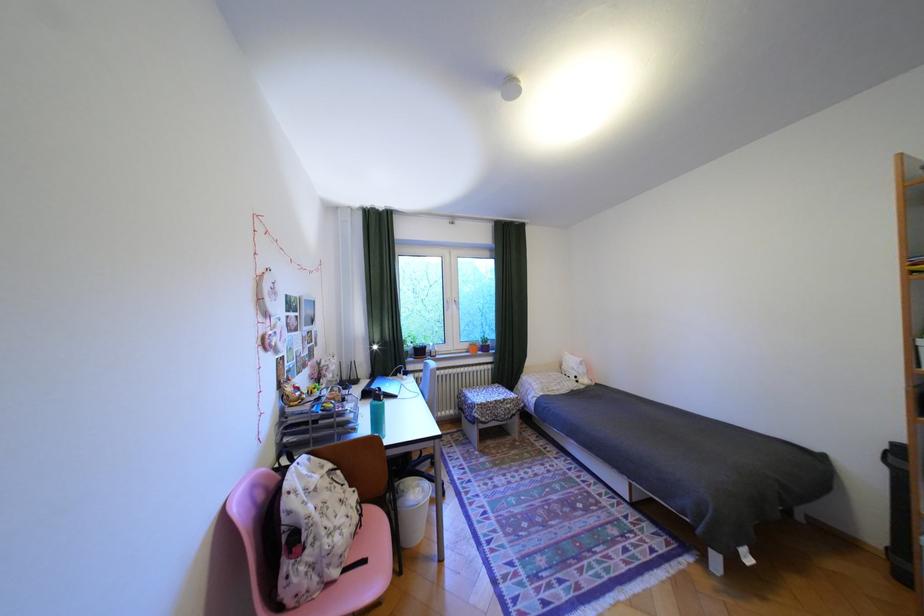
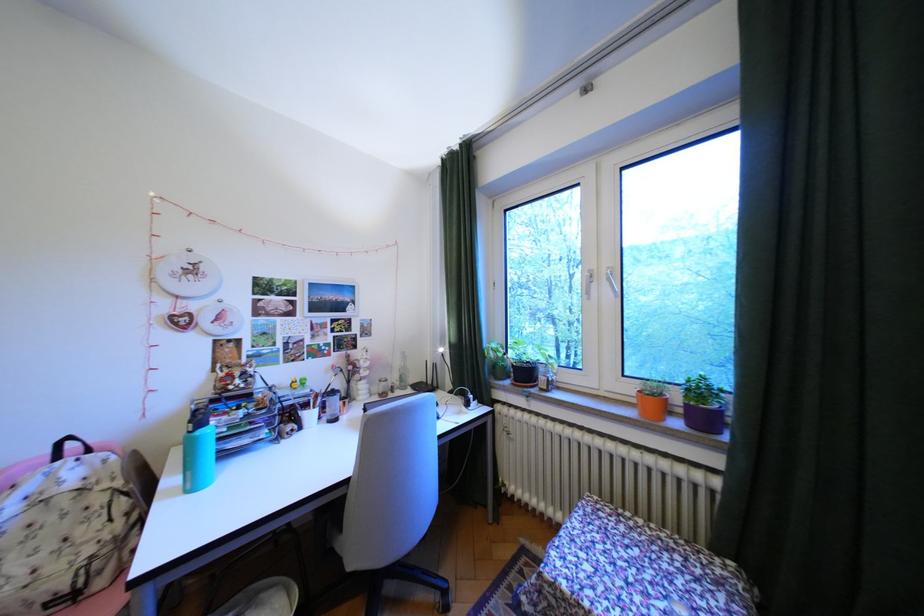
The point at (478, 346) is marked in the first image. Where is the corresponding point in the second image?

(641, 390)